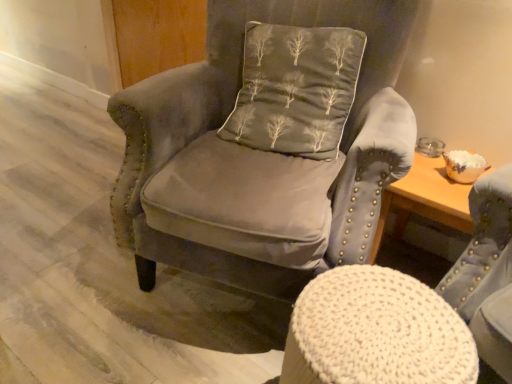
The height and width of the screenshot is (384, 512). What do you see at coordinates (267, 144) in the screenshot?
I see `velvet gray armchair at center, which is the first chair in top-to-bottom order` at bounding box center [267, 144].

Locate an element on the screen. The height and width of the screenshot is (384, 512). knitted fabric stool at center, which is the 1th chair from bottom to top is located at coordinates (487, 272).

Locate an element on the screen. The image size is (512, 384). velvet gray armchair at center, marked as the second chair in a bottom-to-top arrangement is located at coordinates (267, 144).

Is knitted fabric stool at center, which ranks as the 2th chair in top-to-bottom order, taller or shorter than dark gray fabric pillow with tree pattern at center?

Considering their sizes, knitted fabric stool at center, which ranks as the 2th chair in top-to-bottom order, has less height than dark gray fabric pillow with tree pattern at center.

Does knitted fabric stool at center, which is the 1th chair from bottom to top, have a lesser width compared to dark gray fabric pillow with tree pattern at center?

No, knitted fabric stool at center, which is the 1th chair from bottom to top, is not thinner than dark gray fabric pillow with tree pattern at center.

Is knitted fabric stool at center, which ranks as the 2th chair in top-to-bottom order, to the left of dark gray fabric pillow with tree pattern at center from the viewer's perspective?

In fact, knitted fabric stool at center, which ranks as the 2th chair in top-to-bottom order, is to the right of dark gray fabric pillow with tree pattern at center.

Can dark gray fabric pillow with tree pattern at center be found inside knitted fabric stool at center, which ranks as the 2th chair in top-to-bottom order?

No, knitted fabric stool at center, which ranks as the 2th chair in top-to-bottom order, does not contain dark gray fabric pillow with tree pattern at center.

From the image's perspective, is knitted fabric stool at center, which is the 1th chair from bottom to top, above or below velvet gray armchair at center, marked as the second chair in a bottom-to-top arrangement?

Clearly, from the image's perspective, knitted fabric stool at center, which is the 1th chair from bottom to top, is below velvet gray armchair at center, marked as the second chair in a bottom-to-top arrangement.

Considering the points (497, 339) and (145, 130), which point is behind, point (497, 339) or point (145, 130)?

Positioned behind is point (145, 130).

Consider the image. Would you say velvet gray armchair at center, marked as the second chair in a bottom-to-top arrangement, is part of knitted fabric stool at center, which is the 1th chair from bottom to top,'s contents?

No, velvet gray armchair at center, marked as the second chair in a bottom-to-top arrangement, is not inside knitted fabric stool at center, which is the 1th chair from bottom to top.

Does knitted fabric stool at center, which is the 1th chair from bottom to top, appear on the left side of velvet gray armchair at center, marked as the second chair in a bottom-to-top arrangement?

In fact, knitted fabric stool at center, which is the 1th chair from bottom to top, is to the right of velvet gray armchair at center, marked as the second chair in a bottom-to-top arrangement.

Is velvet gray armchair at center, which is the first chair in top-to-bottom order, far from dark gray fabric pillow with tree pattern at center?

No, there isn't a large distance between velvet gray armchair at center, which is the first chair in top-to-bottom order, and dark gray fabric pillow with tree pattern at center.

Based on their sizes in the image, would you say velvet gray armchair at center, which is the first chair in top-to-bottom order, is bigger or smaller than dark gray fabric pillow with tree pattern at center?

velvet gray armchair at center, which is the first chair in top-to-bottom order, is bigger than dark gray fabric pillow with tree pattern at center.

Which object is positioned more to the left, velvet gray armchair at center, which is the first chair in top-to-bottom order, or dark gray fabric pillow with tree pattern at center?

From the viewer's perspective, velvet gray armchair at center, which is the first chair in top-to-bottom order, appears more on the left side.

This screenshot has height=384, width=512. I want to click on chair on the left side of dark gray fabric pillow with tree pattern at center, so (x=267, y=144).

From the image's perspective, between dark gray fabric pillow with tree pattern at center and knitted fabric stool at center, which is the 1th chair from bottom to top, which one is located above?

dark gray fabric pillow with tree pattern at center.

Does point (288, 73) come behind point (450, 288)?

Yes.

From a real-world perspective, relative to knitted fabric stool at center, which ranks as the 2th chair in top-to-bottom order, is dark gray fabric pillow with tree pattern at center vertically above or below?

dark gray fabric pillow with tree pattern at center is situated higher than knitted fabric stool at center, which ranks as the 2th chair in top-to-bottom order, in the real world.

Looking at this image, which of these two, dark gray fabric pillow with tree pattern at center or knitted fabric stool at center, which ranks as the 2th chair in top-to-bottom order, is bigger?

With larger size is dark gray fabric pillow with tree pattern at center.

Which of these two, dark gray fabric pillow with tree pattern at center or velvet gray armchair at center, which is the first chair in top-to-bottom order, is bigger?

velvet gray armchair at center, which is the first chair in top-to-bottom order, is bigger.

Are dark gray fabric pillow with tree pattern at center and velvet gray armchair at center, which is the first chair in top-to-bottom order, far apart?

No, dark gray fabric pillow with tree pattern at center is in close proximity to velvet gray armchair at center, which is the first chair in top-to-bottom order.

From a real-world perspective, is dark gray fabric pillow with tree pattern at center above or below velvet gray armchair at center, marked as the second chair in a bottom-to-top arrangement?

From a real-world perspective, dark gray fabric pillow with tree pattern at center is physically above velvet gray armchair at center, marked as the second chair in a bottom-to-top arrangement.

Considering the relative positions of dark gray fabric pillow with tree pattern at center and velvet gray armchair at center, which is the first chair in top-to-bottom order, in the image provided, is dark gray fabric pillow with tree pattern at center to the right of velvet gray armchair at center, which is the first chair in top-to-bottom order, from the viewer's perspective?

Yes.

Looking at this image, does velvet gray armchair at center, marked as the second chair in a bottom-to-top arrangement, have a lesser width compared to knitted fabric stool at center, which is the 1th chair from bottom to top?

In fact, velvet gray armchair at center, marked as the second chair in a bottom-to-top arrangement, might be wider than knitted fabric stool at center, which is the 1th chair from bottom to top.

Is velvet gray armchair at center, which is the first chair in top-to-bottom order, not near knitted fabric stool at center, which ranks as the 2th chair in top-to-bottom order?

That's not correct — velvet gray armchair at center, which is the first chair in top-to-bottom order, is a little close to knitted fabric stool at center, which ranks as the 2th chair in top-to-bottom order.

Is velvet gray armchair at center, which is the first chair in top-to-bottom order, at the left side of knitted fabric stool at center, which is the 1th chair from bottom to top?

Correct, you'll find velvet gray armchair at center, which is the first chair in top-to-bottom order, to the left of knitted fabric stool at center, which is the 1th chair from bottom to top.

Identify the location of pillow behind the knitted fabric stool at center, which is the 1th chair from bottom to top. (295, 89).

This screenshot has height=384, width=512. I want to click on chair located above the knitted fabric stool at center, which ranks as the 2th chair in top-to-bottom order (from the image's perspective), so click(x=267, y=144).

When comparing their distances from dark gray fabric pillow with tree pattern at center, does knitted fabric stool at center, which ranks as the 2th chair in top-to-bottom order, or velvet gray armchair at center, which is the first chair in top-to-bottom order, seem further?

knitted fabric stool at center, which ranks as the 2th chair in top-to-bottom order, lies further to dark gray fabric pillow with tree pattern at center than the other object.

In the scene shown: When comparing their distances from dark gray fabric pillow with tree pattern at center, does velvet gray armchair at center, marked as the second chair in a bottom-to-top arrangement, or knitted fabric stool at center, which ranks as the 2th chair in top-to-bottom order, seem further?

knitted fabric stool at center, which ranks as the 2th chair in top-to-bottom order.

Considering their positions, is knitted fabric stool at center, which is the 1th chair from bottom to top, positioned closer to velvet gray armchair at center, marked as the second chair in a bottom-to-top arrangement, than dark gray fabric pillow with tree pattern at center?

dark gray fabric pillow with tree pattern at center.

From the image, which object appears to be nearer to velvet gray armchair at center, marked as the second chair in a bottom-to-top arrangement, dark gray fabric pillow with tree pattern at center or knitted fabric stool at center, which is the 1th chair from bottom to top?

The object closer to velvet gray armchair at center, marked as the second chair in a bottom-to-top arrangement, is dark gray fabric pillow with tree pattern at center.

From the image, which object appears to be farther from knitted fabric stool at center, which is the 1th chair from bottom to top, dark gray fabric pillow with tree pattern at center or velvet gray armchair at center, marked as the second chair in a bottom-to-top arrangement?

Among the two, dark gray fabric pillow with tree pattern at center is located further to knitted fabric stool at center, which is the 1th chair from bottom to top.

Looking at the image, which one is located closer to knitted fabric stool at center, which is the 1th chair from bottom to top, velvet gray armchair at center, marked as the second chair in a bottom-to-top arrangement, or dark gray fabric pillow with tree pattern at center?

The object closer to knitted fabric stool at center, which is the 1th chair from bottom to top, is velvet gray armchair at center, marked as the second chair in a bottom-to-top arrangement.

The height and width of the screenshot is (384, 512). I want to click on chair between dark gray fabric pillow with tree pattern at center and knitted fabric stool at center, which ranks as the 2th chair in top-to-bottom order, from top to bottom, so click(x=267, y=144).